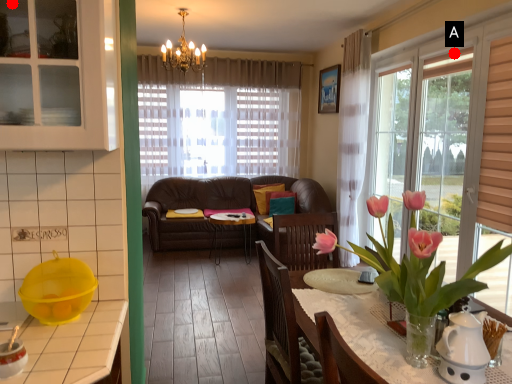
Question: Two points are circled on the image, labeled by A and B beside each circle. Which point is farther from the camera taking this photo?

Choices:
 (A) A is further
 (B) B is further

Answer: (A)